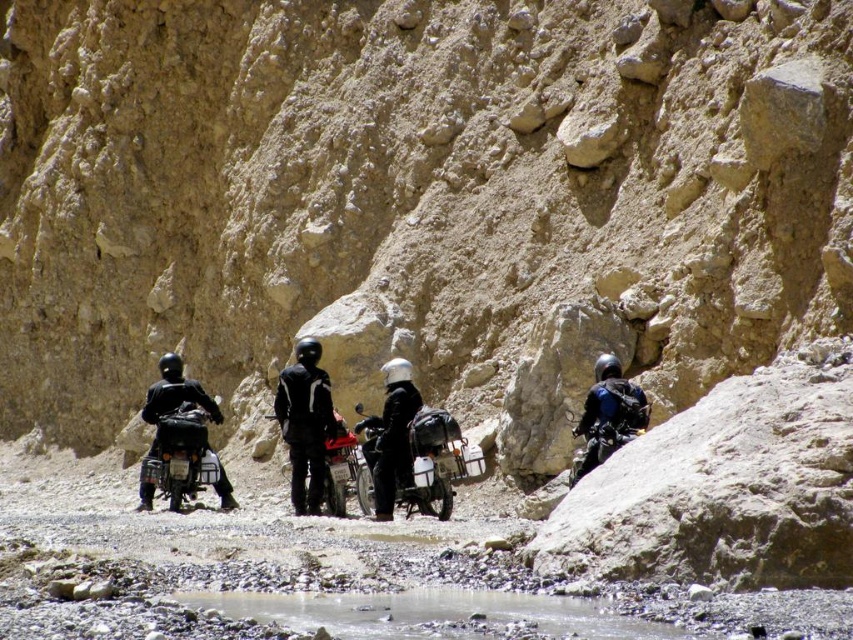
Looking at this image, you are a photographer positioned at the origin point of the image. You want to capture a photo of the matte black motorcycle at center. Given that the motorcycle is represented by the point coordinates point (436, 461), in which direction should you move your camera to frame the motorcycle properly?

The matte black motorcycle at center is located at point (436, 461), so you should move your camera towards the center of the image to frame it properly.

You are a photographer positioned at the highest point of the rocky terrain. You want to capture a clear photo of both the matte black motorcycle at center and the matte black motorcycle at left. Which motorcycle should you focus on first to ensure it appears larger in the photo?

You should focus on the matte black motorcycle at center first because it is closer to the viewer and will appear larger in the photo than the matte black motorcycle at left.